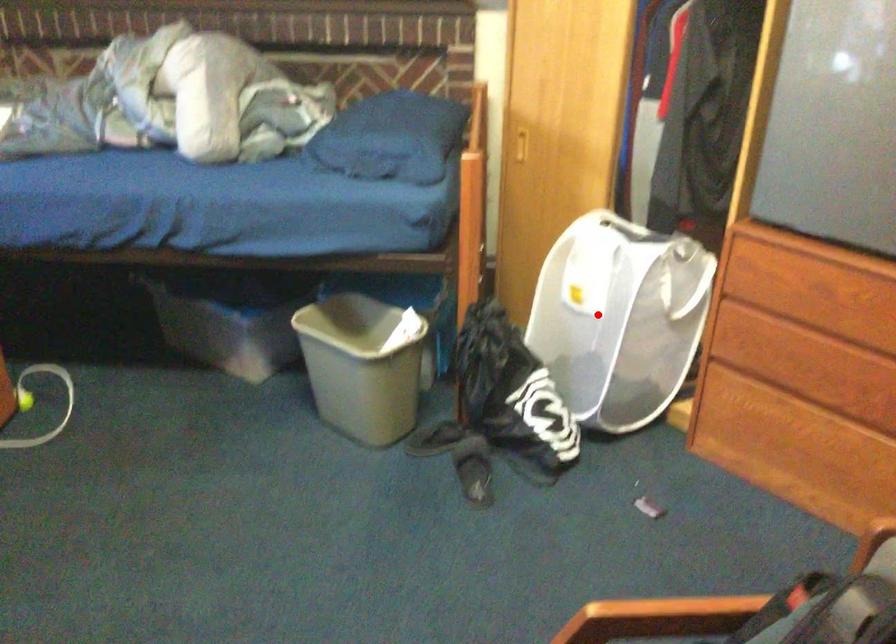
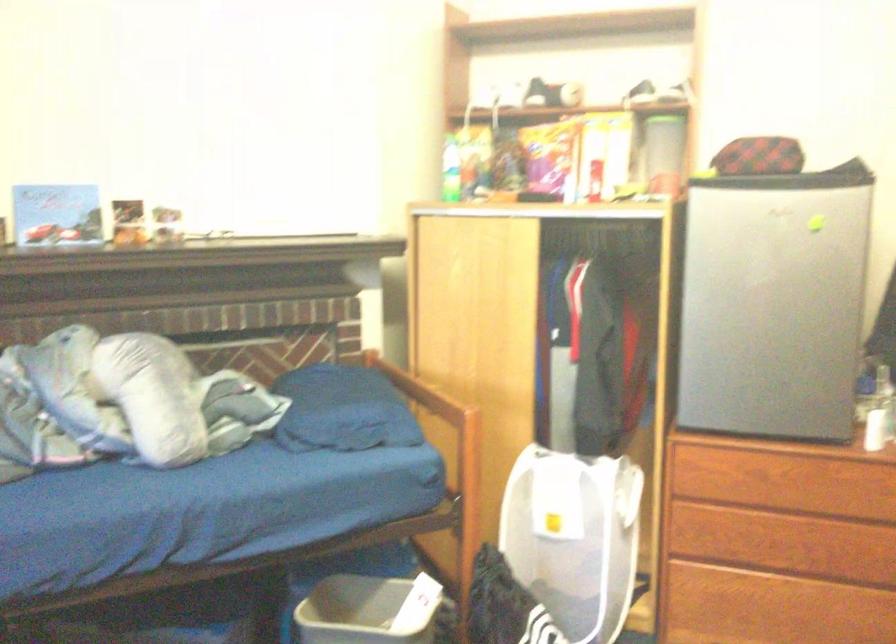
The point at the highlighted location is marked in the first image. Where is the corresponding point in the second image?

(574, 538)